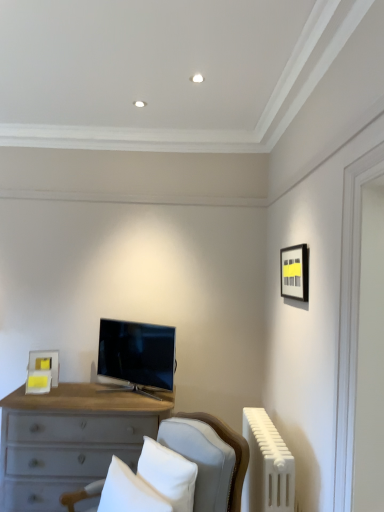
Image resolution: width=384 pixels, height=512 pixels. Describe the element at coordinates (137, 355) in the screenshot. I see `satin black tv at center` at that location.

Image resolution: width=384 pixels, height=512 pixels. I want to click on matte black picture frame at upper right, arranged as the 2th picture frame when viewed from the left, so click(x=294, y=272).

Describe the element at coordinates (209, 458) in the screenshot. I see `light gray wood desk at center` at that location.

Where is `light gray wood desk at center`? The image size is (384, 512). light gray wood desk at center is located at coordinates (209, 458).

How much space does white soft pillow at lower center, which is counted as the 1th pillow, starting from the left, occupy horizontally?

The width of white soft pillow at lower center, which is counted as the 1th pillow, starting from the left, is 8.90 inches.

I want to click on white soft pillow at lower center, which is counted as the 1th pillow, starting from the left, so click(129, 492).

Where is `satin black tv at center`? Image resolution: width=384 pixels, height=512 pixels. satin black tv at center is located at coordinates (137, 355).

Relative to white fabric pillow at center, the second pillow in the left-to-right sequence, is white matte radiator at lower right in front or behind?

white matte radiator at lower right is positioned farther from the viewer than white fabric pillow at center, the second pillow in the left-to-right sequence.

Is white matte radiator at lower right with white fabric pillow at center, the second pillow in the left-to-right sequence?

white matte radiator at lower right is not next to white fabric pillow at center, the second pillow in the left-to-right sequence, and they're not touching.

From a real-world perspective, between white matte radiator at lower right and white fabric pillow at center, the second pillow in the left-to-right sequence, who is vertically higher?

white fabric pillow at center, the second pillow in the left-to-right sequence, from a real-world perspective.

Choose the correct answer: Is white matte radiator at lower right inside white fabric pillow at center, the second pillow in the left-to-right sequence, or outside it?

white matte radiator at lower right lies outside white fabric pillow at center, the second pillow in the left-to-right sequence.

Who is taller, satin black tv at center or white fabric pillow at center, the first pillow positioned from the right?

satin black tv at center.

Is satin black tv at center further to the viewer compared to white fabric pillow at center, the first pillow positioned from the right?

Yes, it is behind white fabric pillow at center, the first pillow positioned from the right.

Which object is positioned more to the right, satin black tv at center or white fabric pillow at center, the second pillow in the left-to-right sequence?

From the viewer's perspective, white fabric pillow at center, the second pillow in the left-to-right sequence, appears more on the right side.

Does satin black tv at center have a lesser width compared to white fabric pillow at center, the second pillow in the left-to-right sequence?

No, satin black tv at center is not thinner than white fabric pillow at center, the second pillow in the left-to-right sequence.

How different are the orientations of matte yellow picture frame at center, which is the first picture frame from left to right, and light gray wood desk at center in degrees?

73.8 degrees separate the facing orientations of matte yellow picture frame at center, which is the first picture frame from left to right, and light gray wood desk at center.

Would you say matte yellow picture frame at center, the 1th picture frame viewed from the back, is inside or outside light gray wood desk at center?

matte yellow picture frame at center, the 1th picture frame viewed from the back, cannot be found inside light gray wood desk at center.

Does matte yellow picture frame at center, which is counted as the second picture frame, starting from the top, have a greater height compared to light gray wood desk at center?

Incorrect, the height of matte yellow picture frame at center, which is counted as the second picture frame, starting from the top, is not larger of that of light gray wood desk at center.

Is matte yellow picture frame at center, which is counted as the second picture frame, starting from the top, aimed at light gray wood desk at center?

Yes.

At what (x,y) coordinates should I click in order to perform the action: click on furniture to the left of white fabric pillow at center, the first pillow positioned from the right. Please return your answer as a coordinate pair (x, y). The image size is (384, 512). Looking at the image, I should click on (209, 458).

Looking at this image, which is nearer, (165, 478) or (239, 455)?

Point (165, 478) is closer to the camera than point (239, 455).

From a real-world perspective, who is located higher, white fabric pillow at center, the second pillow in the left-to-right sequence, or light gray wood desk at center?

white fabric pillow at center, the second pillow in the left-to-right sequence, is physically above.

Considering the sizes of objects white fabric pillow at center, the first pillow positioned from the right, and light gray wood desk at center in the image provided, who is bigger, white fabric pillow at center, the first pillow positioned from the right, or light gray wood desk at center?

Bigger between the two is light gray wood desk at center.

From the image's perspective, between white fabric pillow at center, the second pillow in the left-to-right sequence, and white soft pillow at lower center, positioned as the 2th pillow in right-to-left order, which one is located above?

white fabric pillow at center, the second pillow in the left-to-right sequence.

Is point (188, 488) less distant than point (122, 477)?

Yes.

Consider the image. Could you tell me if white fabric pillow at center, the second pillow in the left-to-right sequence, is facing white soft pillow at lower center, positioned as the 2th pillow in right-to-left order?

Yes, white fabric pillow at center, the second pillow in the left-to-right sequence, faces towards white soft pillow at lower center, positioned as the 2th pillow in right-to-left order.

Would you say white fabric pillow at center, the first pillow positioned from the right, is to the left or to the right of white soft pillow at lower center, positioned as the 2th pillow in right-to-left order, in the picture?

white fabric pillow at center, the first pillow positioned from the right, is to the right of white soft pillow at lower center, positioned as the 2th pillow in right-to-left order.

Which is more to the left, white matte radiator at lower right or white soft pillow at lower center, which is counted as the 1th pillow, starting from the left?

white soft pillow at lower center, which is counted as the 1th pillow, starting from the left, is more to the left.

From the image's perspective, who appears lower, white matte radiator at lower right or white soft pillow at lower center, which is counted as the 1th pillow, starting from the left?

From the image's view, white matte radiator at lower right is below.

Considering the sizes of objects white matte radiator at lower right and white soft pillow at lower center, which is counted as the 1th pillow, starting from the left, in the image provided, who is wider, white matte radiator at lower right or white soft pillow at lower center, which is counted as the 1th pillow, starting from the left,?

With larger width is white soft pillow at lower center, which is counted as the 1th pillow, starting from the left.

Is white matte radiator at lower right not within white soft pillow at lower center, positioned as the 2th pillow in right-to-left order?

Indeed, white matte radiator at lower right is completely outside white soft pillow at lower center, positioned as the 2th pillow in right-to-left order.

Is satin black tv at center further to camera compared to light gray wood desk at center?

Yes, the depth of satin black tv at center is greater than that of light gray wood desk at center.

Locate an element on the screen. television behind the light gray wood desk at center is located at coordinates (137, 355).

Are satin black tv at center and light gray wood desk at center far apart?

Actually, satin black tv at center and light gray wood desk at center are a little close together.

Visually, is satin black tv at center positioned to the left or to the right of light gray wood desk at center?

satin black tv at center is to the left of light gray wood desk at center.

Locate an element on the screen. The width and height of the screenshot is (384, 512). the 1st pillow in front of the white matte radiator at lower right is located at coordinates (168, 474).

Find the location of a particular element. This screenshot has width=384, height=512. television that appears behind the white fabric pillow at center, the second pillow in the left-to-right sequence is located at coordinates (137, 355).

Based on their spatial positions, is light gray wood desk at center or white matte radiator at lower right further from satin black tv at center?

white matte radiator at lower right is positioned further to the anchor satin black tv at center.

In the scene shown: When comparing their distances from light gray wood desk at center, does white soft pillow at lower center, positioned as the 2th pillow in right-to-left order, or matte yellow picture frame at center, which is the first picture frame from left to right, seem closer?

Based on the image, white soft pillow at lower center, positioned as the 2th pillow in right-to-left order, appears to be nearer to light gray wood desk at center.

Which object lies further to the anchor point light gray wood desk at center, satin black tv at center or white matte radiator at lower right?

satin black tv at center is positioned further to the anchor light gray wood desk at center.

Which object lies nearer to the anchor point matte yellow picture frame at center, the 1th picture frame viewed from the back, white fabric pillow at center, the second pillow in the left-to-right sequence, or satin black tv at center?

satin black tv at center.

From the picture: Based on their spatial positions, is white soft pillow at lower center, positioned as the 2th pillow in right-to-left order, or white matte radiator at lower right further from matte yellow picture frame at center, which is the first picture frame in bottom-to-top order?

white matte radiator at lower right is positioned further to the anchor matte yellow picture frame at center, which is the first picture frame in bottom-to-top order.

Which object lies further to the anchor point matte black picture frame at upper right, the second picture frame positioned from the back, satin black tv at center or matte yellow picture frame at center, which is the first picture frame from left to right?

matte yellow picture frame at center, which is the first picture frame from left to right, lies further to matte black picture frame at upper right, the second picture frame positioned from the back, than the other object.

Which object lies nearer to the anchor point matte black picture frame at upper right, the first picture frame when ordered from front to back, white fabric pillow at center, the second pillow in the left-to-right sequence, or satin black tv at center?

satin black tv at center lies closer to matte black picture frame at upper right, the first picture frame when ordered from front to back, than the other object.

Considering their positions, is light gray wood desk at center positioned further to white fabric pillow at center, the first pillow positioned from the right, than matte yellow picture frame at center, the second picture frame positioned from the front?

The object further to white fabric pillow at center, the first pillow positioned from the right, is matte yellow picture frame at center, the second picture frame positioned from the front.

Locate an element on the screen. This screenshot has height=512, width=384. pillow between white soft pillow at lower center, which is counted as the 1th pillow, starting from the left, and satin black tv at center in the front-back direction is located at coordinates (168, 474).

At what (x,y) coordinates should I click in order to perform the action: click on picture frame located between light gray wood desk at center and satin black tv at center in the depth direction. Please return your answer as a coordinate pair (x, y). The width and height of the screenshot is (384, 512). Looking at the image, I should click on (294, 272).

The height and width of the screenshot is (512, 384). Find the location of `furniture between matte black picture frame at upper right, which is counted as the second picture frame, starting from the bottom, and white matte radiator at lower right from top to bottom`. furniture between matte black picture frame at upper right, which is counted as the second picture frame, starting from the bottom, and white matte radiator at lower right from top to bottom is located at coordinates 209,458.

The height and width of the screenshot is (512, 384). In order to click on radiator between matte yellow picture frame at center, which is counted as the second picture frame, starting from the top, and matte black picture frame at upper right, the first picture frame when ordered from front to back, in the horizontal direction in this screenshot , I will do `click(267, 466)`.